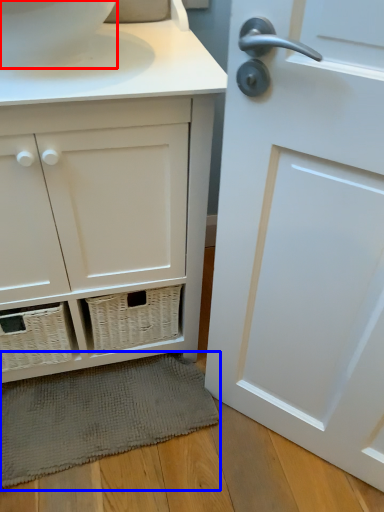
Question: Which point is closer to the camera, toilet bowl (highlighted by a red box) or bath mat (highlighted by a blue box)?

Choices:
 (A) toilet bowl
 (B) bath mat

Answer: (A)